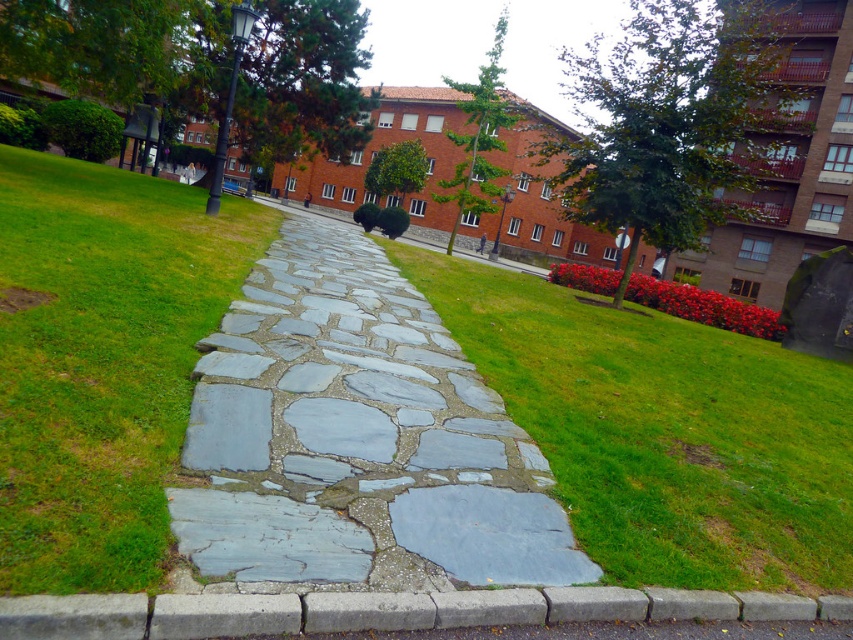
Question: Is gray stone path at center above gray concrete curb at lower center?

Choices:
 (A) yes
 (B) no

Answer: (A)

Question: Considering the relative positions of gray stone path at center and gray concrete curb at lower center in the image provided, where is gray stone path at center located with respect to gray concrete curb at lower center?

Choices:
 (A) left
 (B) right

Answer: (A)

Question: Is gray stone path at center smaller than gray concrete curb at lower center?

Choices:
 (A) no
 (B) yes

Answer: (A)

Question: Which of the following is the farthest from the observer?

Choices:
 (A) gray stone path at center
 (B) gray concrete curb at lower center

Answer: (A)

Question: Which object is closer to the camera taking this photo?

Choices:
 (A) gray concrete curb at lower center
 (B) gray stone path at center

Answer: (A)